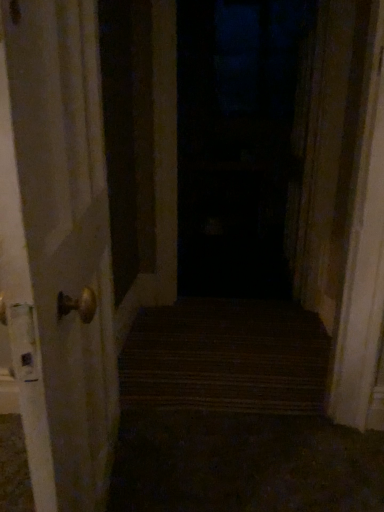
Question: Visually, is transparent glass door at center positioned to the left or to the right of matte gold door handle at left?

Choices:
 (A) left
 (B) right

Answer: (B)

Question: From the image's perspective, is transparent glass door at center located above or below matte gold door handle at left?

Choices:
 (A) above
 (B) below

Answer: (A)

Question: Is transparent glass door at center in front of or behind matte gold door handle at left in the image?

Choices:
 (A) front
 (B) behind

Answer: (B)

Question: From a real-world perspective, is matte gold door handle at left physically located above or below transparent glass door at center?

Choices:
 (A) below
 (B) above

Answer: (A)

Question: Which is correct: matte gold door handle at left is inside transparent glass door at center, or outside of it?

Choices:
 (A) outside
 (B) inside

Answer: (A)

Question: From the image's perspective, is matte gold door handle at left above or below transparent glass door at center?

Choices:
 (A) below
 (B) above

Answer: (A)

Question: In terms of size, does matte gold door handle at left appear bigger or smaller than transparent glass door at center?

Choices:
 (A) small
 (B) big

Answer: (A)